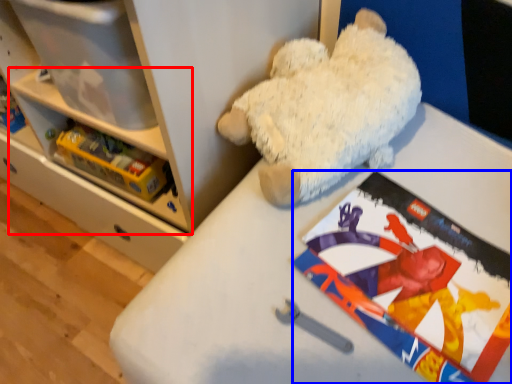
Question: Which of the following is the closest to the observer, shelf (highlighted by a red box) or comic book (highlighted by a blue box)?

Choices:
 (A) shelf
 (B) comic book

Answer: (B)